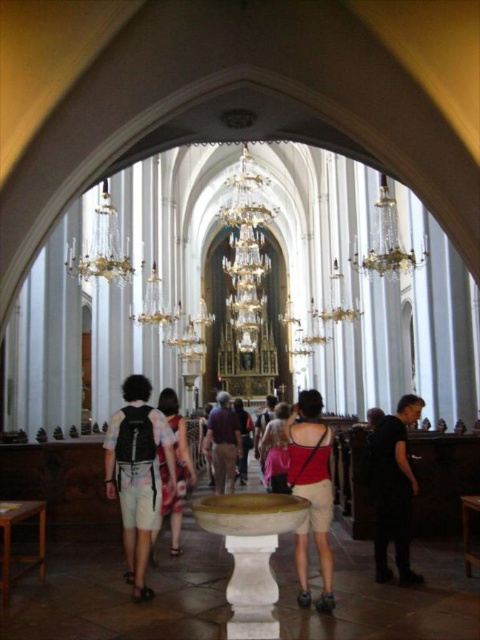
Is point (388, 540) positioned after point (223, 472)?

No, it is not.

Image resolution: width=480 pixels, height=640 pixels. What do you see at coordinates (394, 490) in the screenshot?
I see `black matte shirt at lower right` at bounding box center [394, 490].

Find the location of `black matte shirt at lower right`. black matte shirt at lower right is located at coordinates (394, 490).

Can you confirm if crystal glass chandelier at upper center is positioned to the left of dark purple shirt at center?

No, crystal glass chandelier at upper center is not to the left of dark purple shirt at center.

This screenshot has width=480, height=640. Find the location of `crystal glass chandelier at upper center`. crystal glass chandelier at upper center is located at coordinates (386, 241).

Where is `red fabric tank top at center`? This screenshot has height=640, width=480. red fabric tank top at center is located at coordinates (311, 490).

Is red fabric tank top at center taller than white cotton dress at center?

Yes.

Who is more distant from viewer, (307,493) or (172,493)?

Point (172,493)

You are a GUI agent. You are given a task and a screenshot of the screen. Output one action in this format:
    pyautogui.click(x=<x>, y=<y>)
    Task: Click on the red fabric tank top at center
    The width and height of the screenshot is (480, 640).
    Given the screenshot: What is the action you would take?
    pyautogui.click(x=311, y=490)